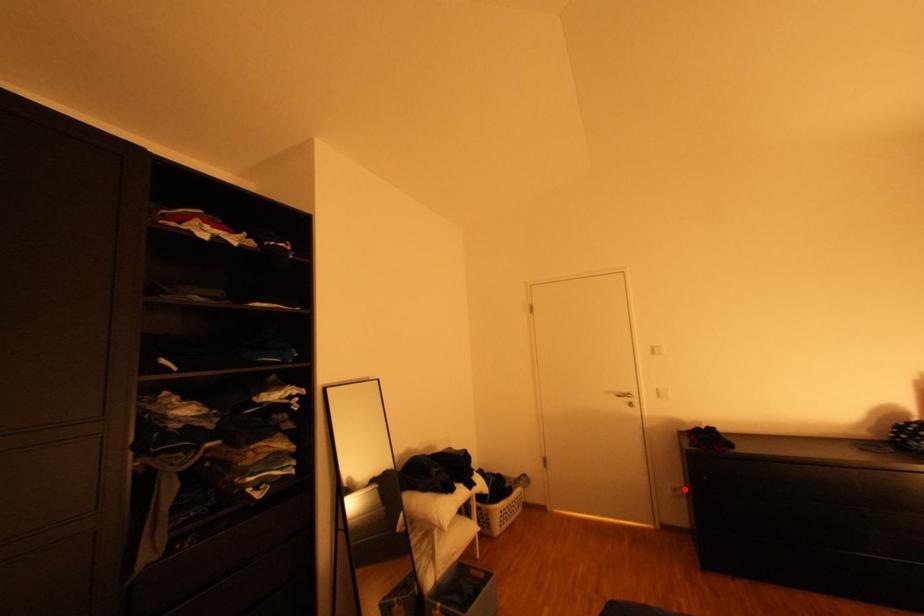
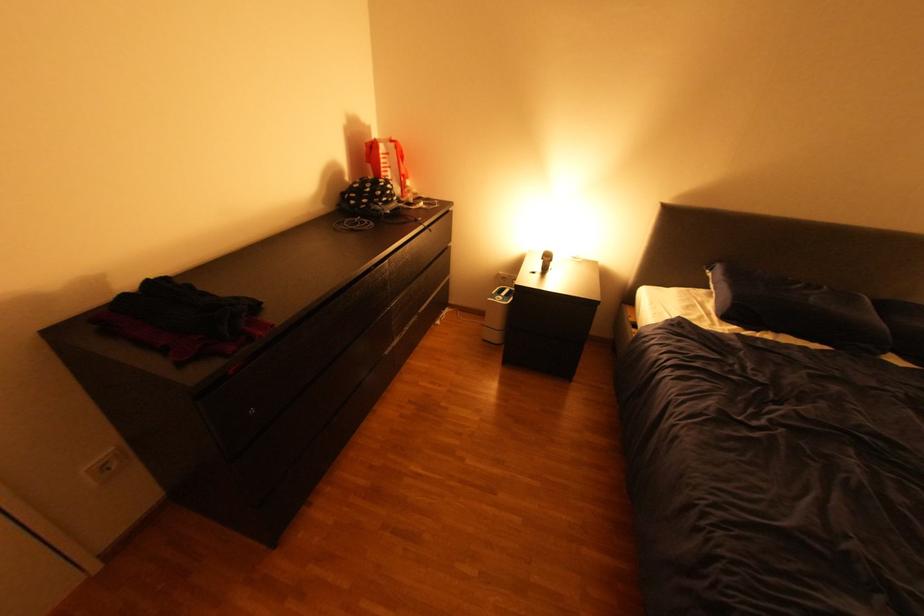
Locate, in the second image, the point that corresponds to the highlighted location in the first image.

(114, 467)